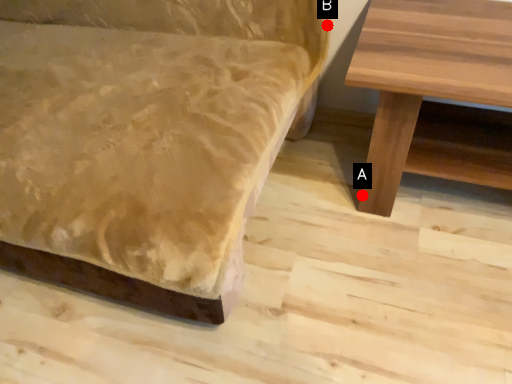
Question: Two points are circled on the image, labeled by A and B beside each circle. Which point appears farthest from the camera in this image?

Choices:
 (A) A is further
 (B) B is further

Answer: (A)